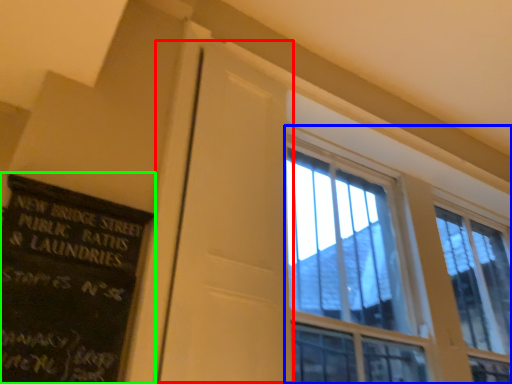
Question: Based on their relative distances, which object is farther from screen door (highlighted by a red box)? Choose from window (highlighted by a blue box) and bulletin board (highlighted by a green box).

Choices:
 (A) window
 (B) bulletin board

Answer: (A)